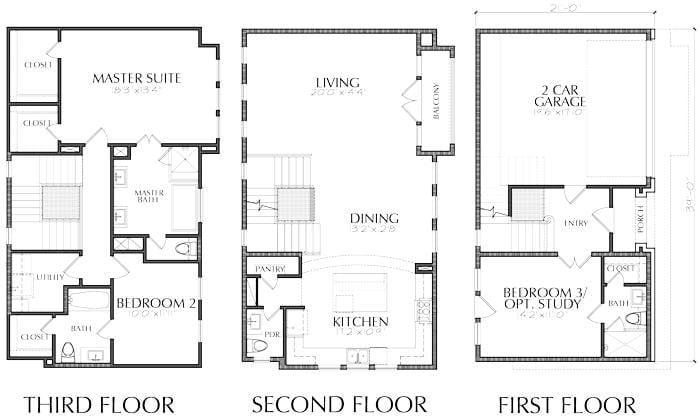
Where is `sinks`? This screenshot has height=417, width=700. sinks is located at coordinates (120, 175), (119, 216), (97, 355), (367, 358), (353, 358), (640, 297), (255, 320).